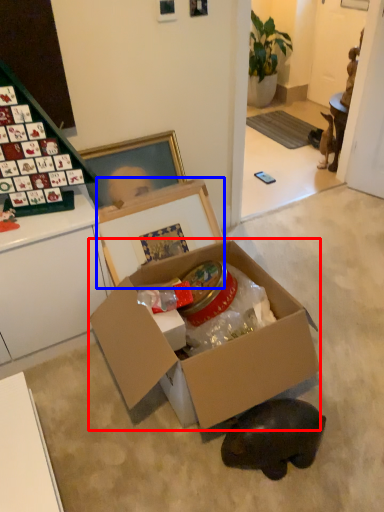
Question: Which of the following is the closest to the observer, box (highlighted by a red box) or cardboard box (highlighted by a blue box)?

Choices:
 (A) box
 (B) cardboard box

Answer: (A)